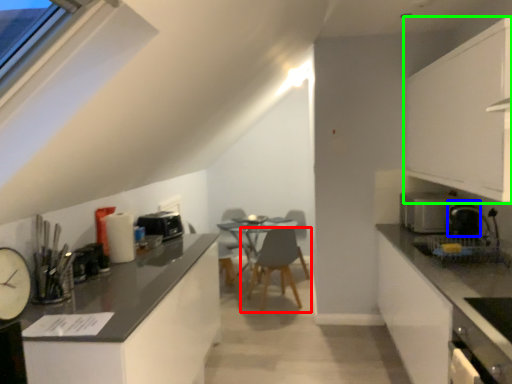
Question: Based on their relative distances, which object is nearer to chair (highlighted by a red box)? Choose from appliance (highlighted by a blue box) and cabinetry (highlighted by a green box).

Choices:
 (A) appliance
 (B) cabinetry

Answer: (A)